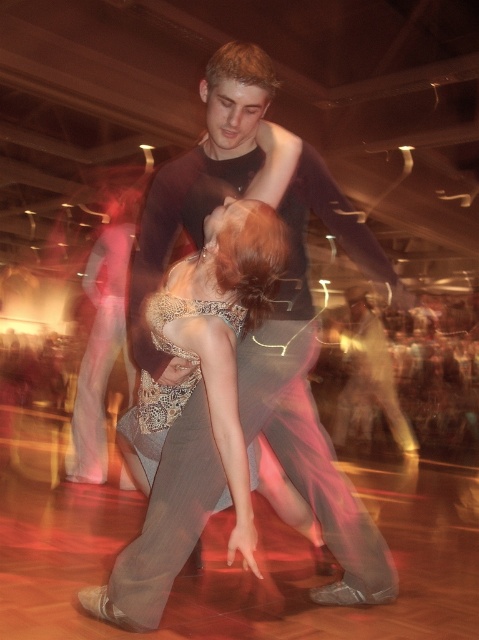
Can you confirm if satin silver dress at center is positioned above light gray pants at center?

Correct, satin silver dress at center is located above light gray pants at center.

Is satin silver dress at center wider than light gray pants at center?

No.

Who is more distant from viewer, (214, 368) or (374, 396)?

The point (374, 396) is behind.

This screenshot has height=640, width=479. In order to click on satin silver dress at center in this screenshot , I will do `click(212, 344)`.

Is point (266, 304) positioned in front of point (152, 300)?

Yes, it is in front of point (152, 300).

This screenshot has width=479, height=640. What are the coordinates of `satin silver dress at center` in the screenshot? It's located at (212, 344).

Can you confirm if satin lace dress at center is shorter than light gray pants at center?

Correct, satin lace dress at center is not as tall as light gray pants at center.

Is point (182, 353) farther from viewer compared to point (401, 426)?

That is False.

Where is `satin lace dress at center`? The width and height of the screenshot is (479, 640). satin lace dress at center is located at coordinates (168, 385).